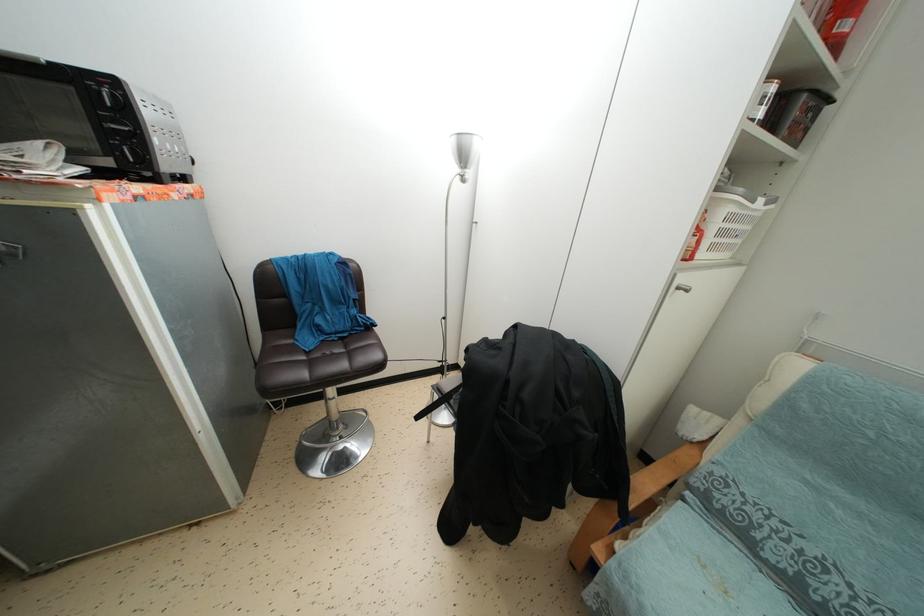
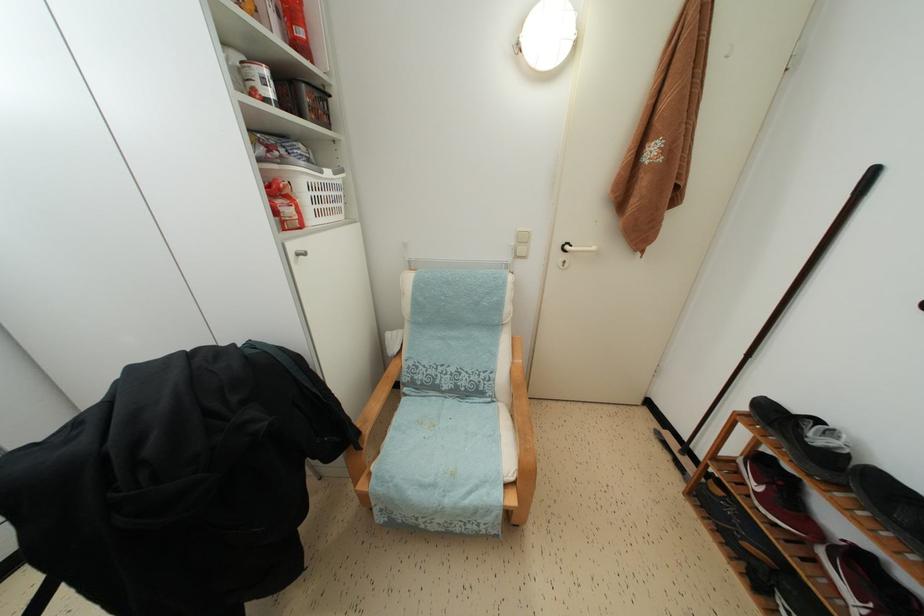
The point at [696,448] is marked in the first image. Where is the corresponding point in the second image?

(399, 362)